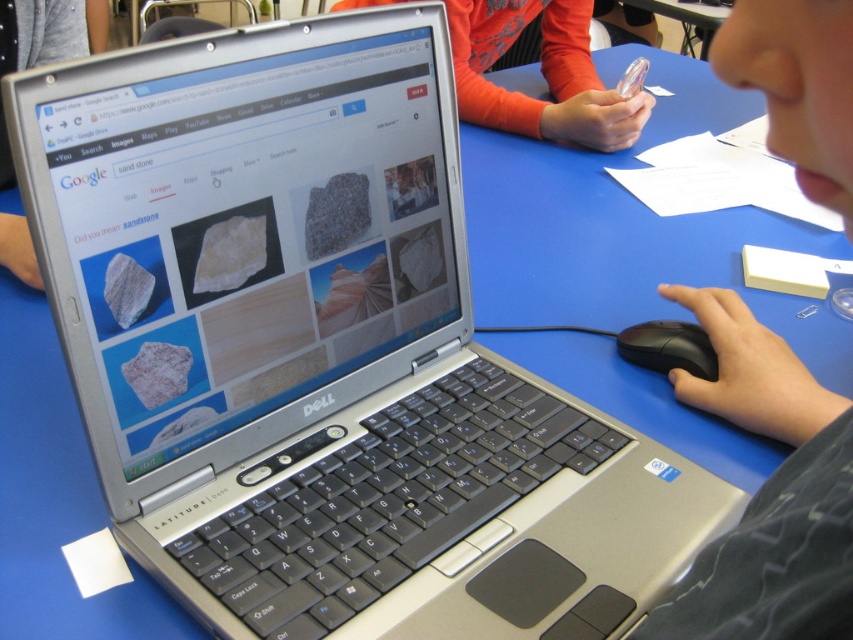
Can you confirm if orange long-sleeve shirt at upper center is positioned above black plastic mouse at right?

Yes, orange long-sleeve shirt at upper center is above black plastic mouse at right.

Is point (556, 8) in front of point (706, 355)?

No, it is not.

This screenshot has width=853, height=640. In order to click on orange long-sleeve shirt at upper center in this screenshot , I will do `click(543, 74)`.

Can you confirm if smooth skin hand at lower right is positioned below orange long-sleeve shirt at upper center?

Indeed, smooth skin hand at lower right is positioned under orange long-sleeve shirt at upper center.

Describe the element at coordinates (767, 493) in the screenshot. Image resolution: width=853 pixels, height=640 pixels. I see `smooth skin hand at lower right` at that location.

You are a GUI agent. You are given a task and a screenshot of the screen. Output one action in this format:
    pyautogui.click(x=<x>, y=<y>)
    Task: Click on the smooth skin hand at lower right
    The height and width of the screenshot is (640, 853).
    Given the screenshot: What is the action you would take?
    pyautogui.click(x=767, y=493)

You are a GUI agent. You are given a task and a screenshot of the screen. Output one action in this format:
    pyautogui.click(x=<x>, y=<y>)
    Task: Click on the smooth skin hand at lower right
    
    Given the screenshot: What is the action you would take?
    coord(767,493)

Does smooth skin hand at lower right lie in front of black plastic mouse at right?

Yes, smooth skin hand at lower right is closer to the viewer.

Can you confirm if smooth skin hand at lower right is positioned above black plastic mouse at right?

No.

Which is behind, point (750, 564) or point (683, 348)?

The point (683, 348) is more distant.

Locate an element on the screen. This screenshot has height=640, width=853. smooth skin hand at lower right is located at coordinates (767, 493).